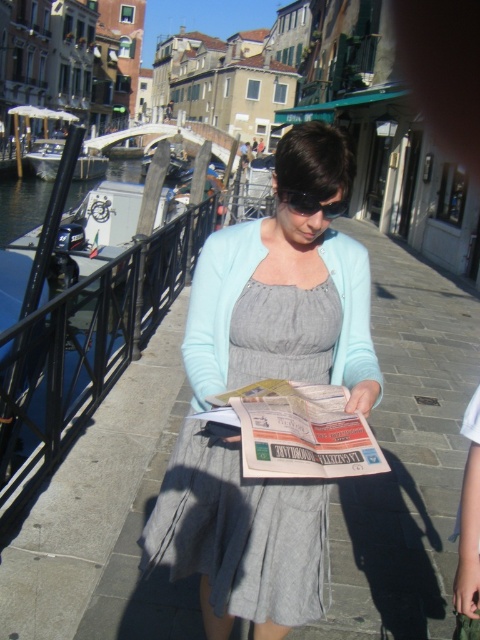
You are a tourist in Venice and want to take a photo of the gray concrete pavement at center and the gray cotton dress at center. Which object should you focus on to ensure it fits entirely within your camera frame?

The gray concrete pavement at center has a larger size compared to gray cotton dress at center, so you should focus on capturing the gray concrete pavement at center to ensure it fits entirely within your camera frame.

What is the 2D coordinate of the gray cotton dress at center?

The gray cotton dress at center is located at the 2D coordinate point of (286, 288).